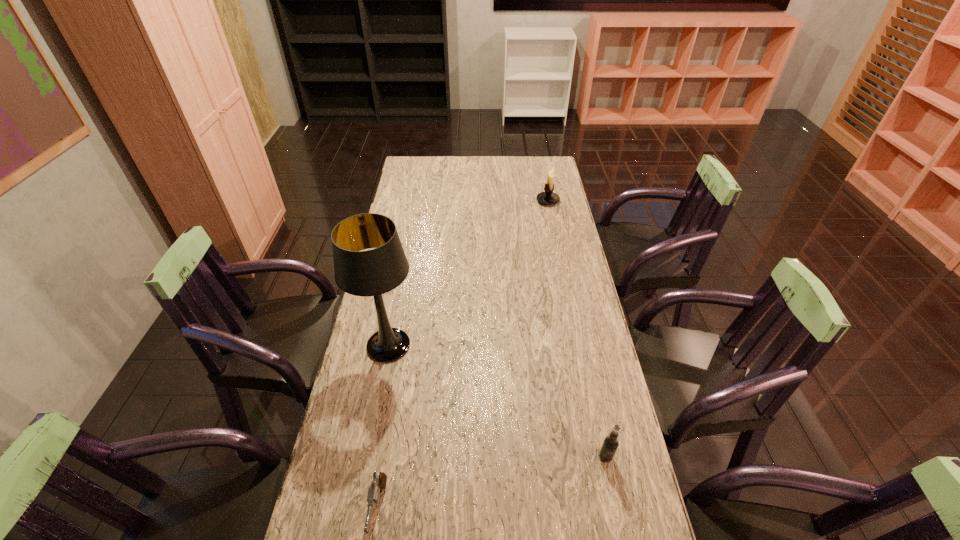
Locate an element on the screen. the second farthest object is located at coordinates (374, 272).

The height and width of the screenshot is (540, 960). I want to click on the tallest object, so click(374, 272).

At what (x,y) coordinates should I click in order to perform the action: click on candle holder. Please return your answer as a coordinate pair (x, y). Looking at the image, I should click on (548, 197).

I want to click on the second shortest object, so click(x=610, y=443).

Locate an element on the screen. The image size is (960, 540). root beer is located at coordinates (610, 443).

The height and width of the screenshot is (540, 960). I want to click on free region located on the back of the table lamp, so click(x=407, y=249).

Find the location of `vacant space located on the left of the farthest object`. vacant space located on the left of the farthest object is located at coordinates (474, 200).

This screenshot has width=960, height=540. Find the location of `free space located 0.140m on the label of the root beer`. free space located 0.140m on the label of the root beer is located at coordinates (620, 524).

The width and height of the screenshot is (960, 540). In order to click on object that is at the left edge in this screenshot , I will do `click(374, 272)`.

The height and width of the screenshot is (540, 960). In order to click on candle holder located at the right edge in this screenshot , I will do `click(548, 197)`.